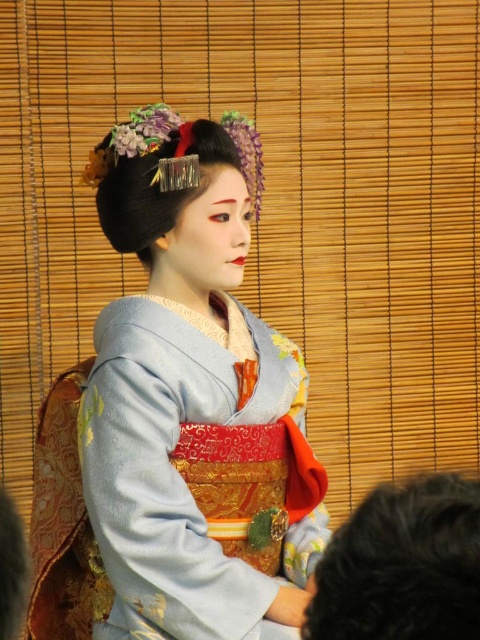
You are an interior designer planning to place a painting of the silky blue kimono at center on a wall. The wall has a coordinate system where the bottom left corner is at point 0.0,0.0 and the top right corner is at point 1.0,1.0. If the painting must be centered at point 0.622, 0.400, will it fit within the wall?

The silky blue kimono at center is positioned at point (192, 397), which lies within the wall coordinates from (0, 0) to (479, 639). Therefore, the painting will fit within the wall.